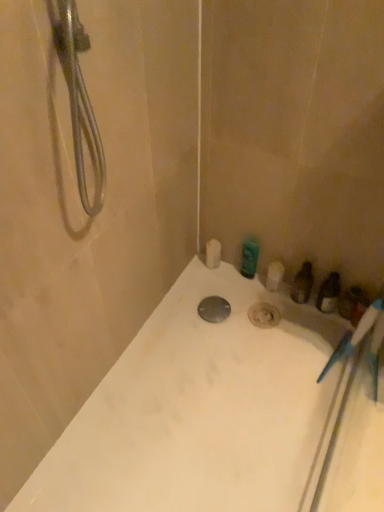
This screenshot has width=384, height=512. I want to click on vacant area that lies between translucent plastic bottle at right, positioned as the 1th toiletry in bottom-to-top order, and metallic silver drain at center, so click(x=265, y=316).